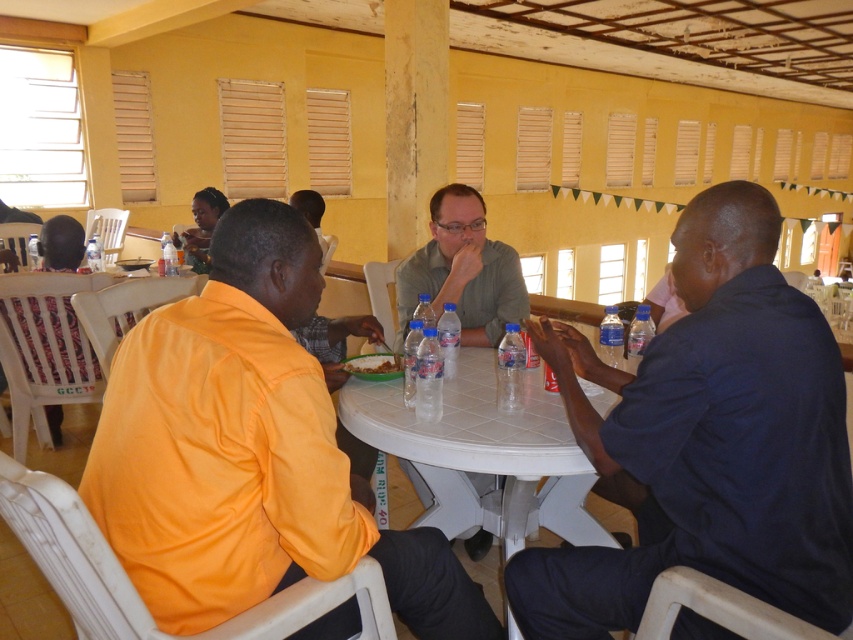
Question: Does dark blue shirt at right appear under matte gray shirt at center?

Choices:
 (A) yes
 (B) no

Answer: (A)

Question: Which point appears farthest from the camera in this image?

Choices:
 (A) (648, 426)
 (B) (463, 234)
 (C) (457, 524)

Answer: (B)

Question: Considering the relative positions of orange fabric shirt at center and white plastic table at center in the image provided, where is orange fabric shirt at center located with respect to white plastic table at center?

Choices:
 (A) right
 (B) left

Answer: (B)

Question: Among these points, which one is nearest to the camera?

Choices:
 (A) (807, 561)
 (B) (410, 298)
 (C) (280, 284)

Answer: (A)

Question: Which of the following is the farthest from the observer?

Choices:
 (A) orange fabric shirt at center
 (B) white plastic table at center
 (C) dark blue shirt at right
 (D) matte gray shirt at center

Answer: (D)

Question: Is orange fabric shirt at center further to the viewer compared to matte gray shirt at center?

Choices:
 (A) yes
 (B) no

Answer: (B)